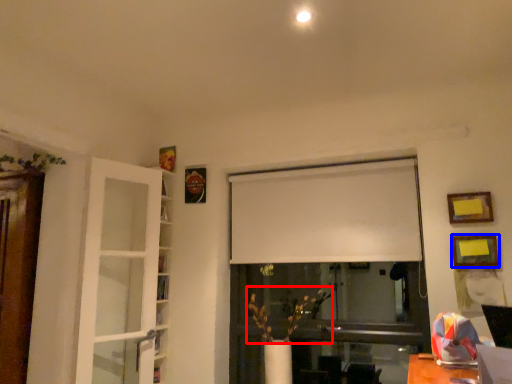
Question: Which of the following is the farthest to the observer, plant (highlighted by a red box) or picture frame (highlighted by a blue box)?

Choices:
 (A) plant
 (B) picture frame

Answer: (A)